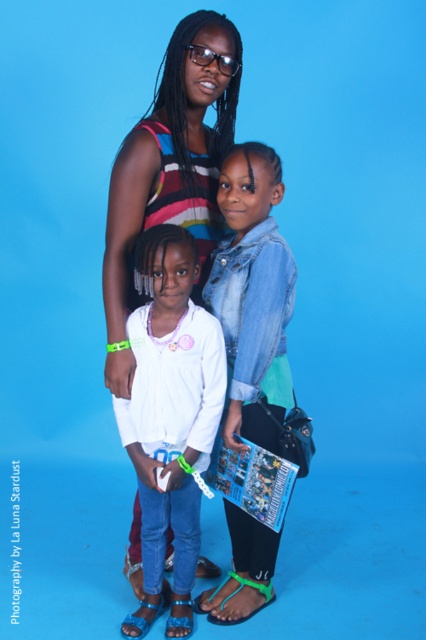
Question: Is striped knit sweater at center thinner than denim jacket at center?

Choices:
 (A) no
 (B) yes

Answer: (A)

Question: Which point appears closest to the camera in this image?

Choices:
 (A) (141, 467)
 (B) (245, 346)
 (C) (233, 576)
 (D) (215, 83)

Answer: (B)

Question: Does striped knit sweater at center appear under denim jacket at center?

Choices:
 (A) yes
 (B) no

Answer: (B)

Question: Is white matte shirt at center above green rubber sandal at lower center?

Choices:
 (A) yes
 (B) no

Answer: (A)

Question: Which point appears closest to the camera in this image?

Choices:
 (A) (112, 285)
 (B) (230, 577)

Answer: (A)

Question: Among these objects, which one is farthest from the camera?

Choices:
 (A) denim jacket at center
 (B) green rubber sandal at lower center
 (C) white matte shirt at center
 (D) striped knit sweater at center

Answer: (B)